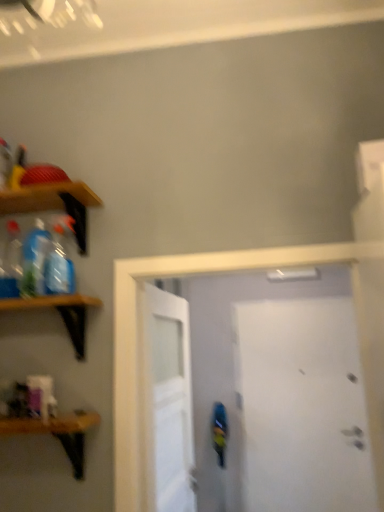
Question: Can translucent plastic bottle at left, which is the 3th bottle from right to left, be found inside wooden shelf at left, the third shelf positioned from the bottom?

Choices:
 (A) no
 (B) yes

Answer: (B)

Question: From a real-world perspective, is wooden shelf at left, which ranks as the first shelf in top-to-bottom order, over translucent plastic bottle at left, the 1th bottle positioned from the left?

Choices:
 (A) yes
 (B) no

Answer: (A)

Question: Is wooden shelf at left, the third shelf positioned from the bottom, shorter than translucent plastic bottle at left, which is the 3th bottle from right to left?

Choices:
 (A) no
 (B) yes

Answer: (B)

Question: Is wooden shelf at left, the third shelf positioned from the bottom, positioned with its back to translucent plastic bottle at left, which is the 3th bottle from right to left?

Choices:
 (A) yes
 (B) no

Answer: (B)

Question: Can you confirm if wooden shelf at left, the third shelf positioned from the bottom, is wider than translucent plastic bottle at left, the 1th bottle positioned from the left?

Choices:
 (A) no
 (B) yes

Answer: (B)

Question: Would you say white matte door at center, which is the second door in front-to-back order, is inside or outside wooden shelf at left, which is the 2th shelf in bottom-to-top order?

Choices:
 (A) inside
 (B) outside

Answer: (B)

Question: In terms of height, does white matte door at center, marked as the 2th door in a back-to-front arrangement, look taller or shorter compared to wooden shelf at left, which is the 2th shelf in bottom-to-top order?

Choices:
 (A) tall
 (B) short

Answer: (A)

Question: Is white matte door at center, which is the second door in front-to-back order, in front of or behind wooden shelf at left, which is the 2th shelf in bottom-to-top order, in the image?

Choices:
 (A) front
 (B) behind

Answer: (B)

Question: Is white matte door at center, which is the second door in front-to-back order, bigger or smaller than wooden shelf at left, which is the 2th shelf in bottom-to-top order?

Choices:
 (A) big
 (B) small

Answer: (A)

Question: Is white matte door at right, which is the third door in front-to-back order, bigger or smaller than wooden shelf at left, which ranks as the 2th shelf in top-to-bottom order?

Choices:
 (A) small
 (B) big

Answer: (B)

Question: Considering the positions of white matte door at right, which is the third door in front-to-back order, and wooden shelf at left, which ranks as the 2th shelf in top-to-bottom order, in the image, is white matte door at right, which is the third door in front-to-back order, wider or thinner than wooden shelf at left, which ranks as the 2th shelf in top-to-bottom order,?

Choices:
 (A) thin
 (B) wide

Answer: (A)

Question: Visually, is white matte door at right, which is the 1th door in back-to-front order, positioned to the left or to the right of wooden shelf at left, which is the 2th shelf in bottom-to-top order?

Choices:
 (A) right
 (B) left

Answer: (A)

Question: Do you think white matte door at right, which is the third door in front-to-back order, is within wooden shelf at left, which is the 2th shelf in bottom-to-top order, or outside of it?

Choices:
 (A) inside
 (B) outside

Answer: (B)

Question: From the image's perspective, relative to white matte door at center, marked as the 2th door in a back-to-front arrangement, is translucent plastic bottle at left, the 1th bottle positioned from the left, above or below?

Choices:
 (A) below
 (B) above

Answer: (B)

Question: From a real-world perspective, is translucent plastic bottle at left, which is the 3th bottle from right to left, physically located above or below white matte door at center, which is the second door in front-to-back order?

Choices:
 (A) below
 (B) above

Answer: (B)